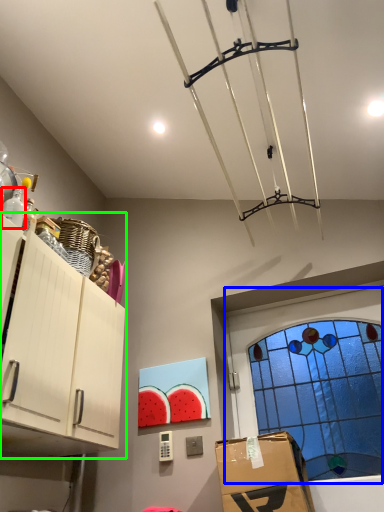
Question: Based on their relative distances, which object is nearer to bottle (highlighted by a red box)? Choose from window (highlighted by a blue box) and cabinetry (highlighted by a green box).

Choices:
 (A) window
 (B) cabinetry

Answer: (B)